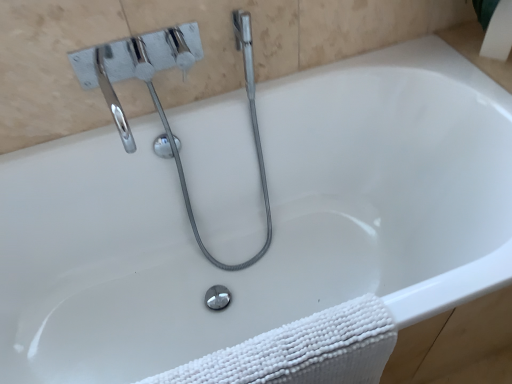
Measure the distance between point (263, 170) and camera.

Point (263, 170) is 4.22 feet from camera.

In order to face chrome/metallic faucet at upper left, should I rotate leftwards or rightwards?

To face it directly, rotate left by 7.406 degrees.

Locate an element on the screen. The width and height of the screenshot is (512, 384). chrome/metallic faucet at upper left is located at coordinates (158, 98).

Describe the element at coordinates (158, 98) in the screenshot. The height and width of the screenshot is (384, 512). I see `chrome/metallic faucet at upper left` at that location.

You are a GUI agent. You are given a task and a screenshot of the screen. Output one action in this format:
    pyautogui.click(x=<x>, y=<y>)
    Task: Click on the white textured towel at lower right
    Image resolution: width=512 pixels, height=384 pixels.
    Given the screenshot: What is the action you would take?
    pyautogui.click(x=302, y=351)

This screenshot has height=384, width=512. What do you see at coordinates (302, 351) in the screenshot?
I see `white textured towel at lower right` at bounding box center [302, 351].

Measure the distance between white textured towel at lower right and camera.

The distance of white textured towel at lower right from camera is 25.81 inches.

Locate an element on the screen. chrome/metallic faucet at upper left is located at coordinates (158, 98).

Which is more to the right, chrome/metallic faucet at upper left or white textured towel at lower right?

white textured towel at lower right is more to the right.

In the image, is chrome/metallic faucet at upper left positioned in front of or behind white textured towel at lower right?

In the image, chrome/metallic faucet at upper left appears behind white textured towel at lower right.

Considering the positions of point (142, 72) and point (362, 335), is point (142, 72) closer or farther from the camera than point (362, 335)?

Point (142, 72) is positioned farther from the camera compared to point (362, 335).

From the image's perspective, between chrome/metallic faucet at upper left and white textured towel at lower right, which one is located above?

From the image's view, chrome/metallic faucet at upper left is above.

From a real-world perspective, between chrome/metallic faucet at upper left and white textured towel at lower right, who is vertically lower?

white textured towel at lower right, from a real-world perspective.

Considering the relative sizes of chrome/metallic faucet at upper left and white textured towel at lower right in the image provided, is chrome/metallic faucet at upper left wider than white textured towel at lower right?

Yes.

Which of these two, chrome/metallic faucet at upper left or white textured towel at lower right, stands taller?

Standing taller between the two is chrome/metallic faucet at upper left.

Considering the relative sizes of chrome/metallic faucet at upper left and white textured towel at lower right in the image provided, is chrome/metallic faucet at upper left smaller than white textured towel at lower right?

No.

Choose the correct answer: Is chrome/metallic faucet at upper left inside white textured towel at lower right or outside it?

chrome/metallic faucet at upper left lies outside white textured towel at lower right.

Are chrome/metallic faucet at upper left and white textured towel at lower right located far from each other?

chrome/metallic faucet at upper left is near white textured towel at lower right, not far away.

Is chrome/metallic faucet at upper left turned away from white textured towel at lower right?

No, chrome/metallic faucet at upper left is not facing the opposite direction of white textured towel at lower right.

How different are the orientations of chrome/metallic faucet at upper left and white textured towel at lower right in degrees?

There is a 2.08-degree angle between the facing directions of chrome/metallic faucet at upper left and white textured towel at lower right.

In the scene shown: How far apart are chrome/metallic faucet at upper left and white textured towel at lower right?

chrome/metallic faucet at upper left and white textured towel at lower right are 24.24 inches apart.

Image resolution: width=512 pixels, height=384 pixels. Identify the location of bath towel in front of the chrome/metallic faucet at upper left. (302, 351).

Between white textured towel at lower right and chrome/metallic faucet at upper left, which one appears on the right side from the viewer's perspective?

From the viewer's perspective, white textured towel at lower right appears more on the right side.

Which object is closer to the camera, white textured towel at lower right or chrome/metallic faucet at upper left?

white textured towel at lower right.

Is point (297, 328) in front of point (184, 40)?

Yes, point (297, 328) is in front of point (184, 40).

From the image's perspective, is white textured towel at lower right over chrome/metallic faucet at upper left?

No, from the image's perspective, white textured towel at lower right is not on top of chrome/metallic faucet at upper left.

From a real-world perspective, is white textured towel at lower right positioned above or below chrome/metallic faucet at upper left?

Clearly, from a real-world perspective, white textured towel at lower right is below chrome/metallic faucet at upper left.

Looking at their sizes, would you say white textured towel at lower right is wider or thinner than chrome/metallic faucet at upper left?

white textured towel at lower right is thinner than chrome/metallic faucet at upper left.

Is white textured towel at lower right shorter than chrome/metallic faucet at upper left?

Yes, white textured towel at lower right is shorter than chrome/metallic faucet at upper left.

Looking at the image, does white textured towel at lower right seem bigger or smaller compared to chrome/metallic faucet at upper left?

Considering their sizes, white textured towel at lower right takes up less space than chrome/metallic faucet at upper left.

Is white textured towel at lower right surrounding chrome/metallic faucet at upper left?

No, chrome/metallic faucet at upper left is not a part of white textured towel at lower right.

Is the surface of white textured towel at lower right in direct contact with chrome/metallic faucet at upper left?

No, white textured towel at lower right is not touching chrome/metallic faucet at upper left.

Could you tell me if white textured towel at lower right is turned towards chrome/metallic faucet at upper left?

No, white textured towel at lower right is not turned towards chrome/metallic faucet at upper left.

What's the angular difference between white textured towel at lower right and chrome/metallic faucet at upper left's facing directions?

The angular difference between white textured towel at lower right and chrome/metallic faucet at upper left is 2.08 degrees.

Measure the distance between white textured towel at lower right and chrome/metallic faucet at upper left.

They are 24.24 inches apart.

In the image, there is a white textured towel at lower right. Where is `plumbing fixture above it (from the image's perspective)`? The width and height of the screenshot is (512, 384). plumbing fixture above it (from the image's perspective) is located at coordinates (158, 98).

The width and height of the screenshot is (512, 384). What are the coordinates of `bath towel directly beneath the chrome/metallic faucet at upper left (from a real-world perspective)` in the screenshot? It's located at (302, 351).

Locate an element on the screen. Image resolution: width=512 pixels, height=384 pixels. plumbing fixture on the left of white textured towel at lower right is located at coordinates (158, 98).